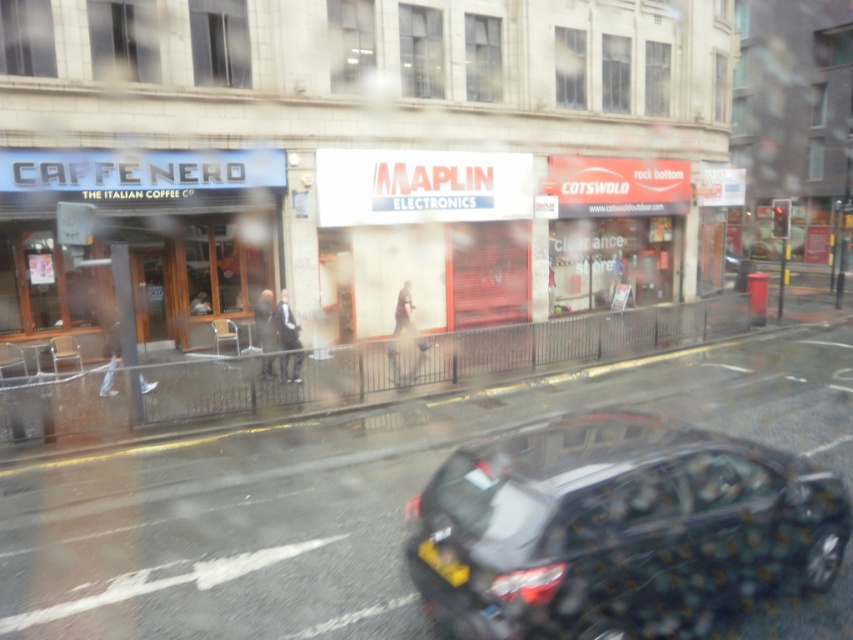
Who is positioned more to the right, metallic gray hatchback at lower center or matte black storefront at left?

metallic gray hatchback at lower center

Which is in front, point (430, 512) or point (230, 172)?

Point (430, 512) is more forward.

Is point (844, 515) farther from viewer compared to point (189, 163)?

No, it is in front of (189, 163).

In order to click on metallic gray hatchback at lower center in this screenshot , I will do `click(619, 529)`.

Does metallic gray hatchback at lower center appear under yellow matte license plate at lower center?

No, metallic gray hatchback at lower center is not below yellow matte license plate at lower center.

Between metallic gray hatchback at lower center and yellow matte license plate at lower center, which one is positioned lower?

yellow matte license plate at lower center is below.

This screenshot has width=853, height=640. Find the location of `metallic gray hatchback at lower center`. metallic gray hatchback at lower center is located at coordinates (619, 529).

Who is positioned more to the left, matte black storefront at left or yellow matte license plate at lower center?

Positioned to the left is matte black storefront at left.

Does matte black storefront at left appear on the right side of yellow matte license plate at lower center?

Incorrect, matte black storefront at left is not on the right side of yellow matte license plate at lower center.

Between point (105, 308) and point (436, 572), which one is positioned behind?

The point (105, 308) is behind.

This screenshot has width=853, height=640. I want to click on matte black storefront at left, so click(137, 240).